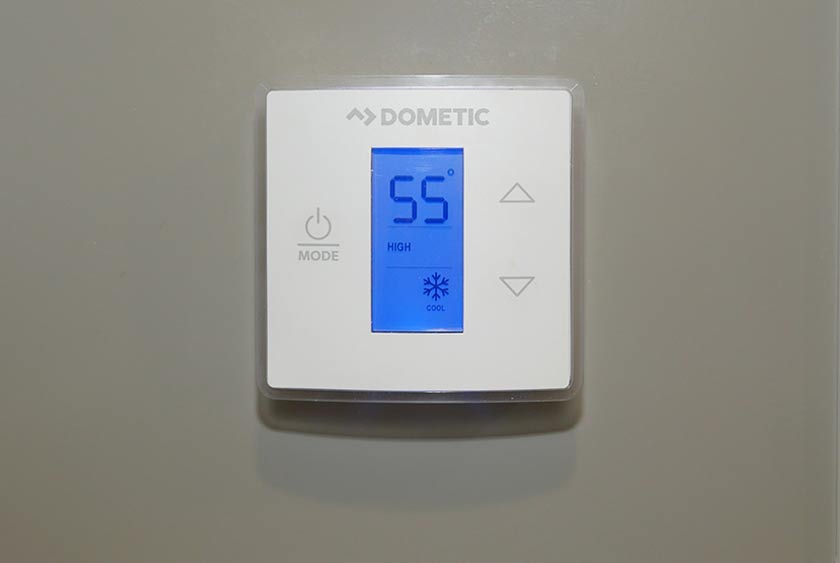
Where is `gray wall`? The height and width of the screenshot is (563, 840). gray wall is located at coordinates (702, 236).